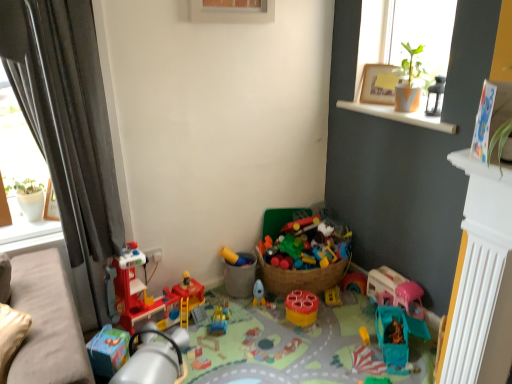
Question: In which direction should I rotate to look at plastic construction set at center, the third toy when ordered from right to left?

Choices:
 (A) right
 (B) left

Answer: (A)

Question: From a real-world perspective, is pink plastic toy at lower right, positioned as the 1th toy in right-to-left order, located higher than white wood window sill at upper right?

Choices:
 (A) yes
 (B) no

Answer: (B)

Question: Is pink plastic toy at lower right, positioned as the 1th toy in right-to-left order, not close to white wood window sill at upper right?

Choices:
 (A) yes
 (B) no

Answer: (B)

Question: Can you confirm if pink plastic toy at lower right, positioned as the 1th toy in right-to-left order, is shorter than white wood window sill at upper right?

Choices:
 (A) yes
 (B) no

Answer: (B)

Question: Does pink plastic toy at lower right, positioned as the 1th toy in right-to-left order, have a greater width compared to white wood window sill at upper right?

Choices:
 (A) no
 (B) yes

Answer: (A)

Question: Is pink plastic toy at lower right, positioned as the 1th toy in right-to-left order, positioned before white wood window sill at upper right?

Choices:
 (A) yes
 (B) no

Answer: (B)

Question: Considering the relative sizes of pink plastic toy at lower right, the 7th toy from the left, and white wood window sill at upper right in the image provided, is pink plastic toy at lower right, the 7th toy from the left, smaller than white wood window sill at upper right?

Choices:
 (A) yes
 (B) no

Answer: (A)

Question: Can you confirm if gray fabric curtain at left is wider than matte plastic cup at center, which is the 2th toy in right-to-left order?

Choices:
 (A) yes
 (B) no

Answer: (A)

Question: Is gray fabric curtain at left taller than matte plastic cup at center, which is the 2th toy in right-to-left order?

Choices:
 (A) yes
 (B) no

Answer: (A)

Question: Is gray fabric curtain at left behind matte plastic cup at center, which is the 2th toy in right-to-left order?

Choices:
 (A) no
 (B) yes

Answer: (A)

Question: Considering the relative positions of gray fabric curtain at left and matte plastic cup at center, the sixth toy from the left, in the image provided, is gray fabric curtain at left to the left of matte plastic cup at center, the sixth toy from the left, from the viewer's perspective?

Choices:
 (A) yes
 (B) no

Answer: (A)

Question: Would you consider gray fabric curtain at left to be distant from matte plastic cup at center, which is the 2th toy in right-to-left order?

Choices:
 (A) yes
 (B) no

Answer: (A)

Question: From a real-world perspective, is gray fabric curtain at left physically below matte plastic cup at center, which is the 2th toy in right-to-left order?

Choices:
 (A) yes
 (B) no

Answer: (B)

Question: Does beige fabric couch at lower left have a larger size compared to white wood window sill at upper right?

Choices:
 (A) no
 (B) yes

Answer: (B)